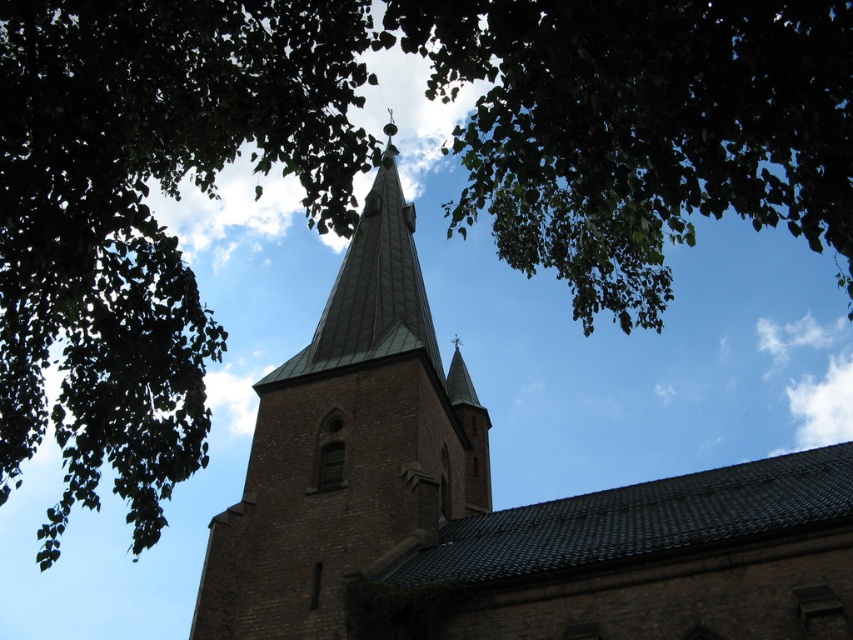
Consider the image. Can you confirm if green leafy tree at upper left is positioned above brown brick tower at center?

Yes, green leafy tree at upper left is above brown brick tower at center.

Who is more distant from viewer, (202, 49) or (322, 541)?

Point (322, 541)

Find the location of a particular element. The image size is (853, 640). green leafy tree at upper left is located at coordinates (144, 212).

Is point (837, 458) less distant than point (292, 561)?

No, it is behind (292, 561).

Which is more to the left, brown brick church steeple at center or brown brick tower at center?

brown brick tower at center

Does point (653, 620) lie behind point (280, 556)?

No, (653, 620) is in front of (280, 556).

In order to click on brown brick church steeple at center in this screenshot , I will do `click(490, 499)`.

Which is more to the right, green leafy tree at upper left or green leafy branches at upper center?

From the viewer's perspective, green leafy branches at upper center appears more on the right side.

Does green leafy tree at upper left have a smaller size compared to green leafy branches at upper center?

Actually, green leafy tree at upper left might be larger than green leafy branches at upper center.

Who is more forward, (71, 317) or (498, 84)?

Point (71, 317)

This screenshot has height=640, width=853. In order to click on green leafy tree at upper left in this screenshot , I will do `click(144, 212)`.